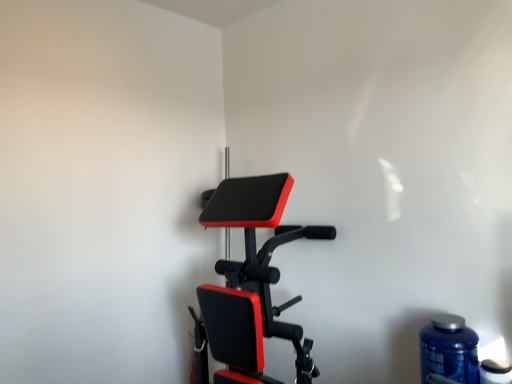
Question: Does blue plastic bottle at lower right, the first bottle from the left, have a larger size compared to blue plastic bottle at lower right, which is the 2th bottle from left to right?

Choices:
 (A) yes
 (B) no

Answer: (A)

Question: Is blue plastic bottle at lower right, which is counted as the 2th bottle, starting from the right, facing away from blue plastic bottle at lower right, which is the 2th bottle from left to right?

Choices:
 (A) no
 (B) yes

Answer: (A)

Question: Is the depth of blue plastic bottle at lower right, the first bottle from the left, greater than that of blue plastic bottle at lower right, positioned as the 1th bottle in right-to-left order?

Choices:
 (A) no
 (B) yes

Answer: (B)

Question: From a real-world perspective, is blue plastic bottle at lower right, the first bottle from the left, located higher than blue plastic bottle at lower right, which is the 2th bottle from left to right?

Choices:
 (A) no
 (B) yes

Answer: (B)

Question: Can we say blue plastic bottle at lower right, which is counted as the 2th bottle, starting from the right, lies outside blue plastic bottle at lower right, which is the 2th bottle from left to right?

Choices:
 (A) yes
 (B) no

Answer: (A)

Question: Visually, is matte black stationary bicycle at center positioned to the left or to the right of blue plastic bottle at lower right, which is counted as the 2th bottle, starting from the right?

Choices:
 (A) right
 (B) left

Answer: (B)

Question: Is matte black stationary bicycle at center wider or thinner than blue plastic bottle at lower right, which is counted as the 2th bottle, starting from the right?

Choices:
 (A) wide
 (B) thin

Answer: (A)

Question: From the image's perspective, is matte black stationary bicycle at center located above or below blue plastic bottle at lower right, which is counted as the 2th bottle, starting from the right?

Choices:
 (A) above
 (B) below

Answer: (A)

Question: From their relative heights in the image, would you say matte black stationary bicycle at center is taller or shorter than blue plastic bottle at lower right, which is counted as the 2th bottle, starting from the right?

Choices:
 (A) tall
 (B) short

Answer: (A)

Question: Based on their sizes in the image, would you say matte black stationary bicycle at center is bigger or smaller than blue plastic bottle at lower right, which is the 2th bottle from left to right?

Choices:
 (A) small
 (B) big

Answer: (B)

Question: Does point (228, 332) appear closer or farther from the camera than point (480, 374)?

Choices:
 (A) farther
 (B) closer

Answer: (A)

Question: Looking at their shapes, would you say matte black stationary bicycle at center is wider or thinner than blue plastic bottle at lower right, positioned as the 1th bottle in right-to-left order?

Choices:
 (A) wide
 (B) thin

Answer: (A)

Question: From the image's perspective, is matte black stationary bicycle at center above or below blue plastic bottle at lower right, positioned as the 1th bottle in right-to-left order?

Choices:
 (A) below
 (B) above

Answer: (B)

Question: Is point (482, 362) positioned closer to the camera than point (465, 382)?

Choices:
 (A) farther
 (B) closer

Answer: (A)

Question: From a real-world perspective, is blue plastic bottle at lower right, which is the 2th bottle from left to right, physically located above or below blue plastic bottle at lower right, the first bottle from the left?

Choices:
 (A) above
 (B) below

Answer: (B)